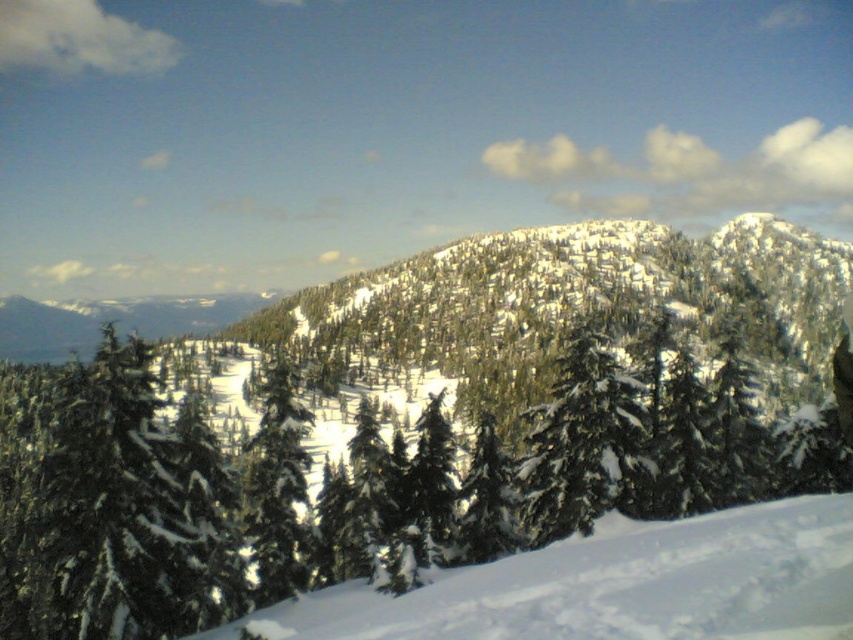
What do you see at coordinates (416, 422) in the screenshot?
I see `green matte tree at center` at bounding box center [416, 422].

Does green matte tree at center have a greater height compared to green textured pine tree at left?

Correct, green matte tree at center is much taller as green textured pine tree at left.

The image size is (853, 640). I want to click on green matte tree at center, so click(416, 422).

How distant is green matte tree at center from white snow at lower right?

green matte tree at center and white snow at lower right are 85.43 meters apart.

Between point (654, 273) and point (598, 627), which one is positioned in front?

Positioned in front is point (598, 627).

Does point (595, 433) lie in front of point (718, 550)?

No, it is behind (718, 550).

Where is `green matte tree at center`? The image size is (853, 640). green matte tree at center is located at coordinates (416, 422).

Who is positioned more to the right, white snow at lower right or green matte evergreen at center?

green matte evergreen at center is more to the right.

Can you confirm if white snow at lower right is taller than green matte evergreen at center?

Incorrect, white snow at lower right's height is not larger of green matte evergreen at center's.

In order to click on white snow at lower right in this screenshot , I will do `click(616, 586)`.